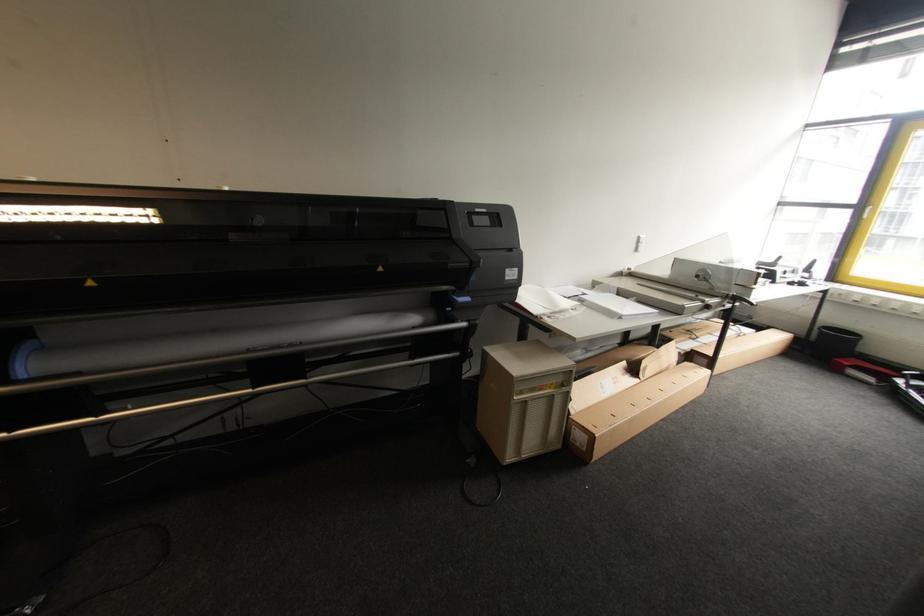
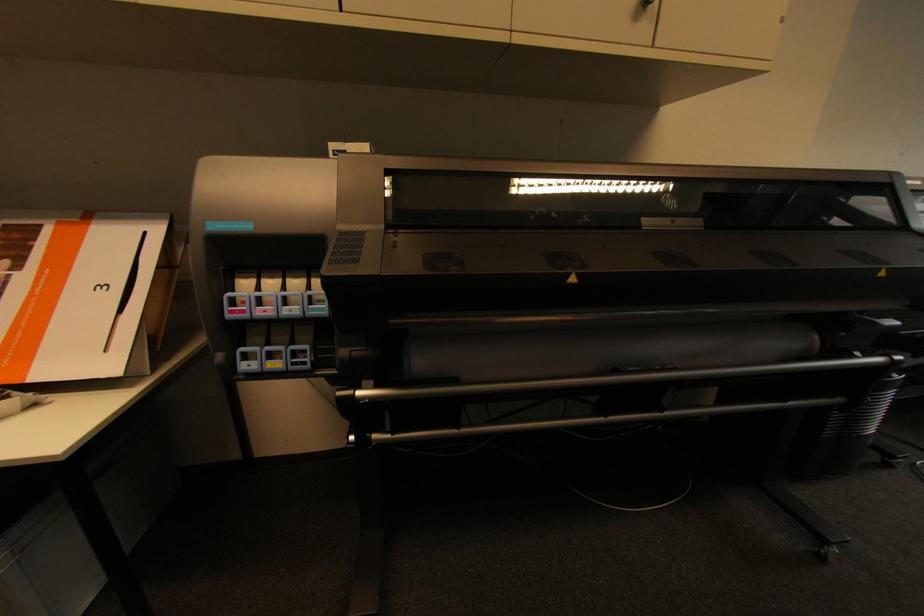
In a continuous first-person perspective shot, in which direction is the camera moving?

The cameraman walked toward left, backward.